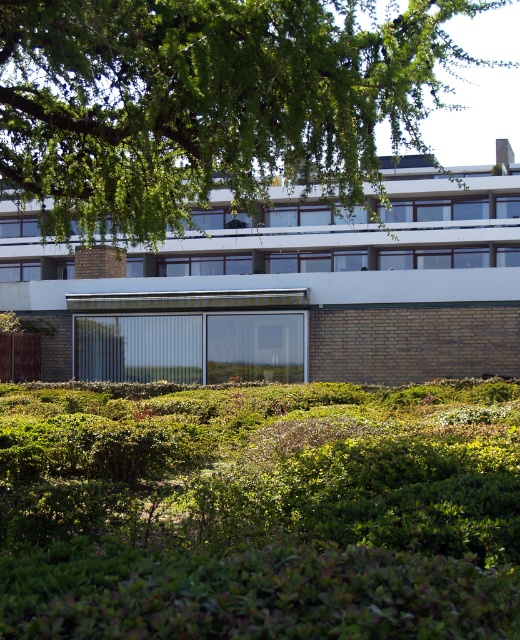
You are standing in front of the modern building with a brick wall and glass facade. You notice a point marked at coordinates (260, 509). Based on the scene description, can you determine what this point is located on?

The point at (260, 509) is located on the green leafy hedge at lower center.

Consider the image. You are standing in front of the modern building and want to know the exact 2D coordinates of the green leafy hedge at lower center. According to the image description, what are its coordinates?

The green leafy hedge at lower center is located at the 2D coordinates of point [260,509].